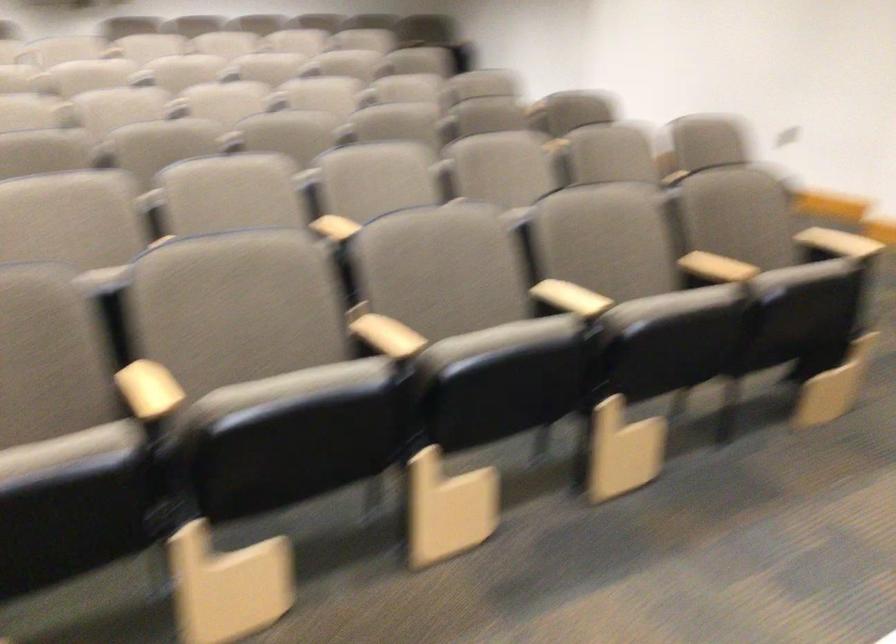
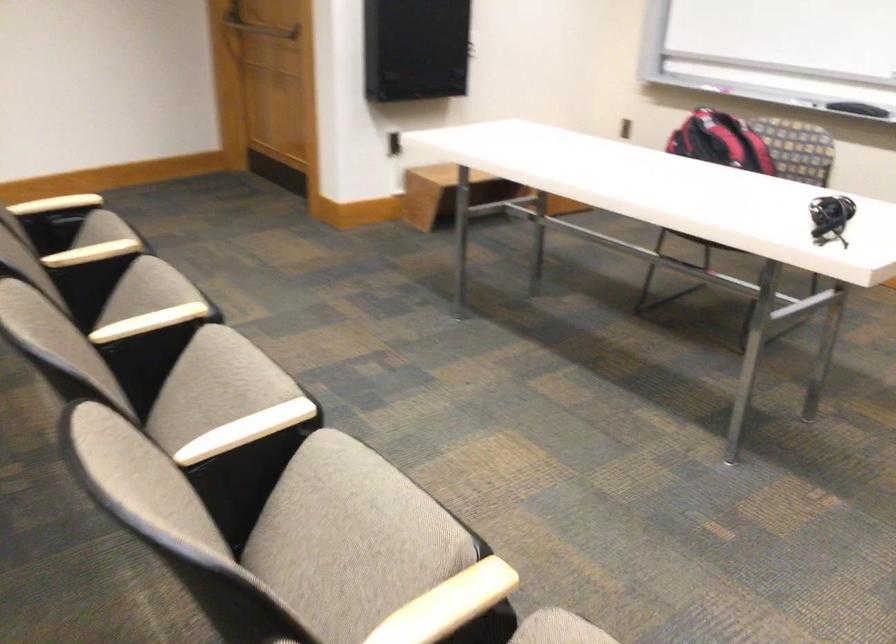
Where in the second image is the point corresponding to the point at 276,402 from the first image?

(352, 531)